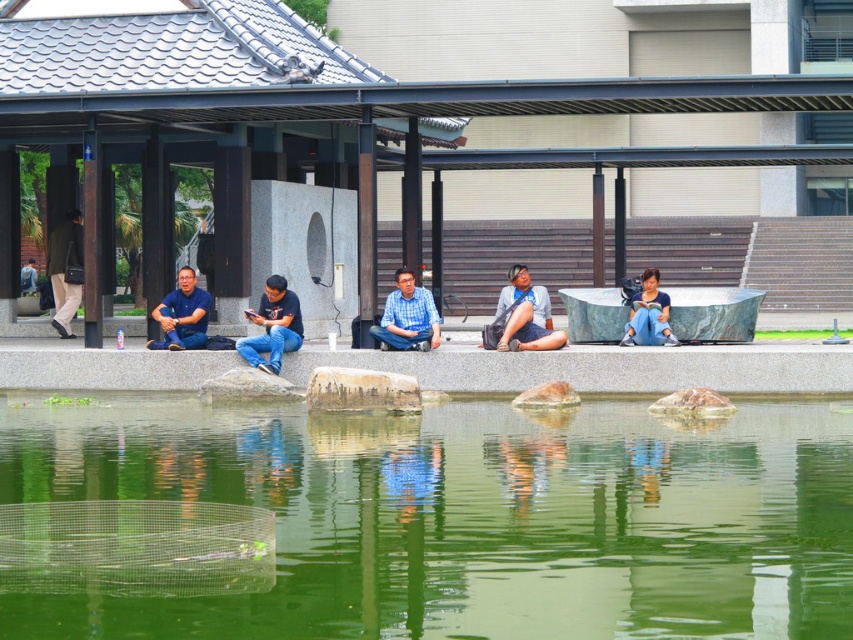
Question: Can you confirm if denim shorts at center is positioned above blue fabric pants at center?

Choices:
 (A) yes
 (B) no

Answer: (B)

Question: Which point is farther to the camera?

Choices:
 (A) gray stone ledge at center
 (B) green liquid water at center

Answer: (A)

Question: Among these objects, which one is nearest to the camera?

Choices:
 (A) brown rough stone at center
 (B) matte blue shirt at left
 (C) blue checkered shirt at center

Answer: (A)

Question: Does denim shorts at center have a greater width compared to blue checkered shirt at center?

Choices:
 (A) yes
 (B) no

Answer: (B)

Question: Which point is farther from the camera taking this photo?

Choices:
 (A) (41, 342)
 (B) (283, 294)
 (C) (267, 483)
 (D) (165, 326)

Answer: (A)

Question: Is green liquid water at center to the left of brown rough stone at center from the viewer's perspective?

Choices:
 (A) yes
 (B) no

Answer: (B)